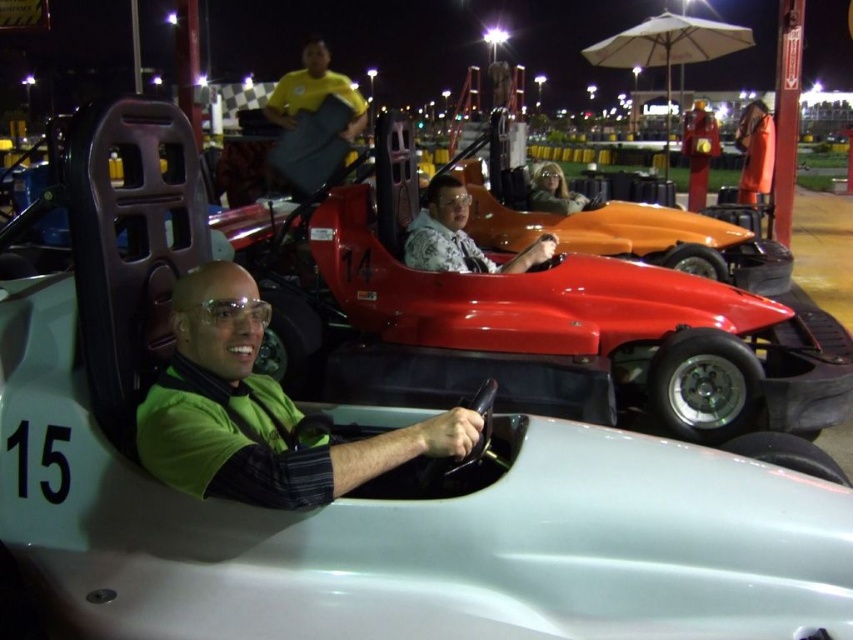
Question: Which point appears farthest from the camera in this image?

Choices:
 (A) (750, 188)
 (B) (553, 186)
 (C) (218, 484)

Answer: (A)

Question: Can you confirm if patterned fabric shirt at center is positioned to the left of orange fabric coat at upper right?

Choices:
 (A) no
 (B) yes

Answer: (B)

Question: Which object appears closest to the camera in this image?

Choices:
 (A) matte orange helmet at center
 (B) orange fabric coat at upper right
 (C) patterned fabric shirt at center

Answer: (C)

Question: Estimate the real-world distances between objects in this image. Which object is farther from the green matte shirt at center?

Choices:
 (A) matte orange helmet at center
 (B) patterned fabric shirt at center
 (C) shiny red race car at center

Answer: (A)

Question: Can you confirm if green matte shirt at center is positioned below patterned fabric shirt at center?

Choices:
 (A) yes
 (B) no

Answer: (A)

Question: Can you confirm if shiny red race car at center is wider than matte orange helmet at center?

Choices:
 (A) no
 (B) yes

Answer: (B)